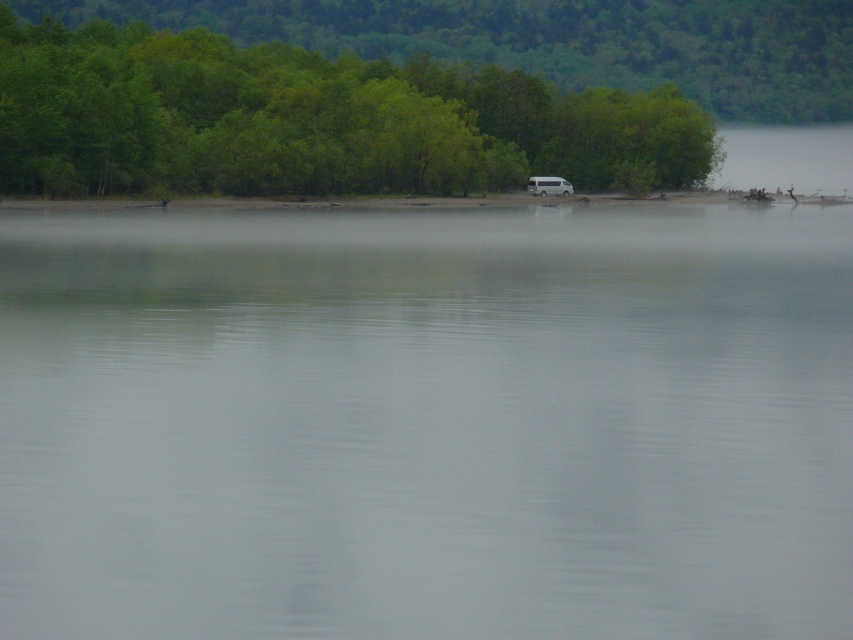
You are standing at the lakeside and see the clear water at center and the white matte van at center. Which object is closer to the water surface?

The clear water at center is located below the white matte van at center, so the clear water at center is closer to the water surface.

Looking at this image, you are driving a white matte van at center and want to park it near the clear water at center. The parking spot requires a vehicle to be at least 50 meters away from the water to prevent environmental damage. Can you park the van in its current position?

The clear water at center is 53.52 meters from the white matte van at center. Since the required distance is at least 50 meters, the van can be parked in its current position as it meets the environmental safety requirement.